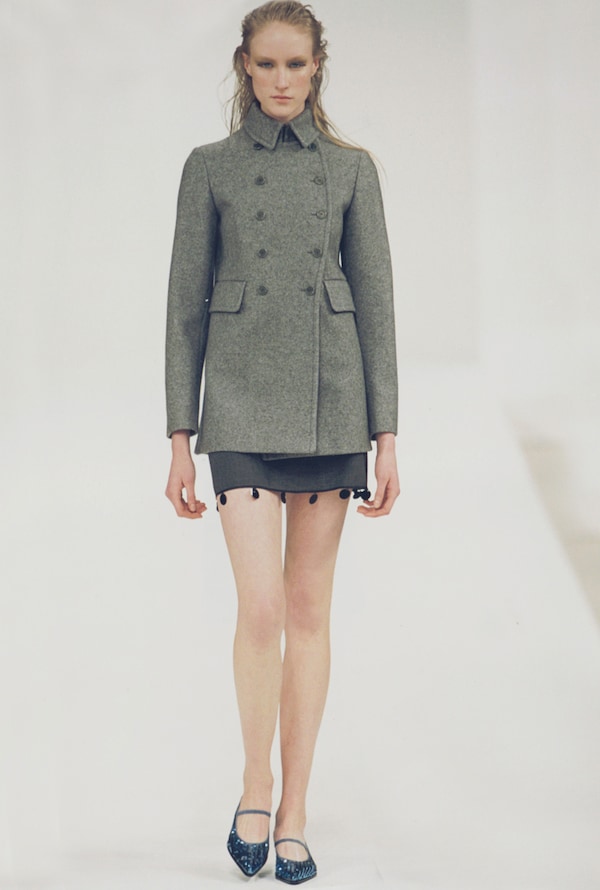
Where is `wall`? wall is located at coordinates (440, 101).